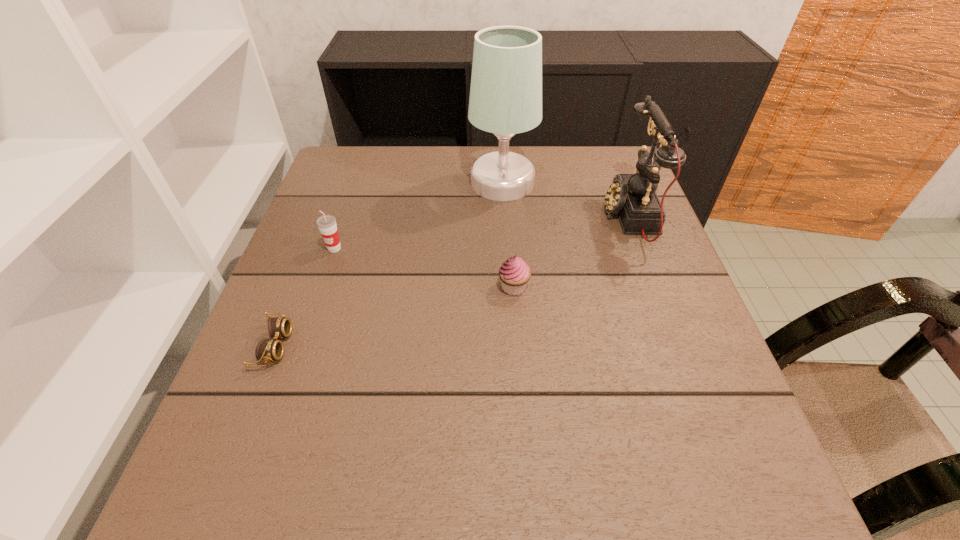
The width and height of the screenshot is (960, 540). In order to click on the tallest object in this screenshot , I will do pyautogui.click(x=505, y=99).

Where is `telephone`? telephone is located at coordinates (633, 197).

I want to click on the rightmost object, so click(633, 197).

At what (x,y) coordinates should I click in order to perform the action: click on the third shortest object. Please return your answer as a coordinate pair (x, y). This screenshot has height=540, width=960. Looking at the image, I should click on (327, 225).

Image resolution: width=960 pixels, height=540 pixels. What are the coordinates of `the second object from left to right` in the screenshot? It's located at (327, 225).

Locate an element on the screen. This screenshot has height=540, width=960. cupcake is located at coordinates (514, 273).

Identify the location of the second nearest object. Image resolution: width=960 pixels, height=540 pixels. (514, 273).

The image size is (960, 540). What are the coordinates of `goggles` in the screenshot? It's located at (268, 350).

Find the location of a particular element. The height and width of the screenshot is (540, 960). the leftmost object is located at coordinates (268, 350).

You are a GUI agent. You are given a task and a screenshot of the screen. Output one action in this format:
    pyautogui.click(x=<x>, y=<y>)
    Task: Click on the vacant space located 0.170m on the base of the tallest object
    The image size is (960, 540).
    Given the screenshot: What is the action you would take?
    pyautogui.click(x=405, y=183)